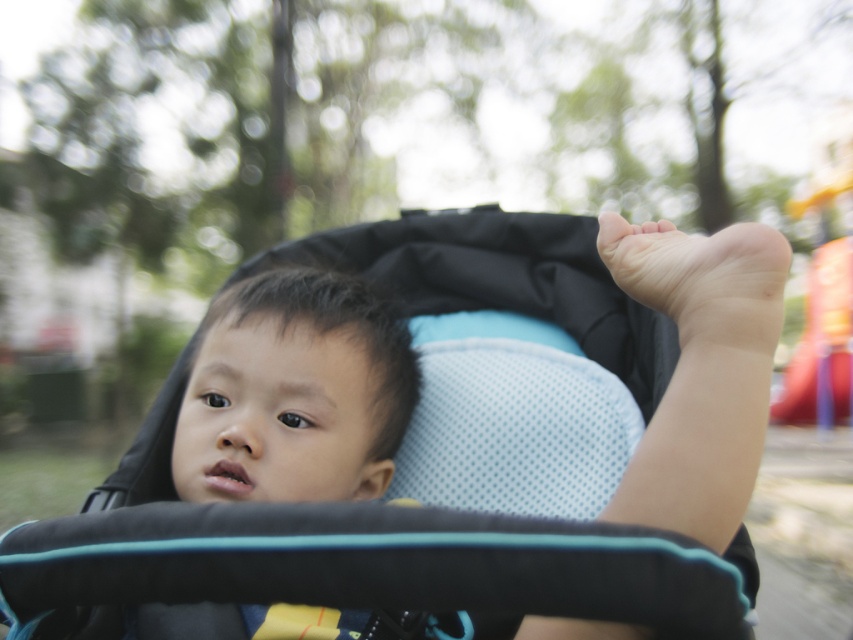
Based on the photo, who is more distant from viewer, [381,573] or [245,396]?

The point [245,396] is behind.

Does matte black stroller at center have a larger size compared to black mesh baby stroller at center?

Yes.

Where is `matte black stroller at center`? The height and width of the screenshot is (640, 853). matte black stroller at center is located at coordinates (384, 582).

Identify the location of matte black stroller at center. (384, 582).